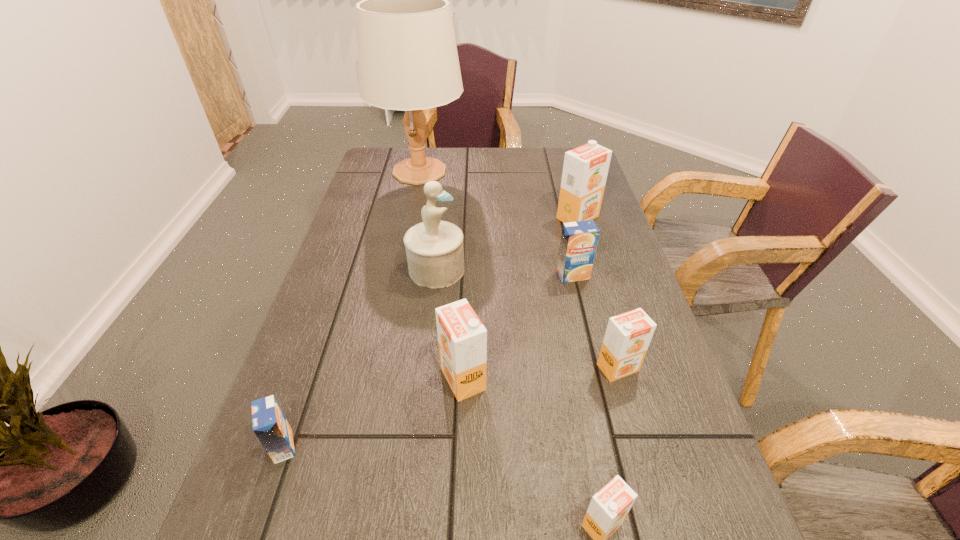
This screenshot has height=540, width=960. In order to click on blank space that satisfies the following two spatial constraints: 1. at the beak of the white figurine; 2. on the left side of the third biggest orange orange juice in this screenshot , I will do `click(425, 368)`.

Where is `vacant point that satisfies the following two spatial constraints: 1. on the back side of the farthest orange orange juice; 2. on the left side of the third biggest orange orange juice`? This screenshot has width=960, height=540. vacant point that satisfies the following two spatial constraints: 1. on the back side of the farthest orange orange juice; 2. on the left side of the third biggest orange orange juice is located at coordinates (575, 218).

Image resolution: width=960 pixels, height=540 pixels. Identify the location of free space that satisfies the following two spatial constraints: 1. at the beak of the white figurine; 2. on the right side of the third biggest orange orange juice. point(425,368).

Image resolution: width=960 pixels, height=540 pixels. Identify the location of vacant area that satisfies the following two spatial constraints: 1. at the beak of the white figurine; 2. on the back side of the fifth orange juice from right to left. (424, 379).

Find the location of a particular element. vacant space that satisfies the following two spatial constraints: 1. at the beak of the fifth nearest orange juice; 2. on the right side of the figurine is located at coordinates (436, 275).